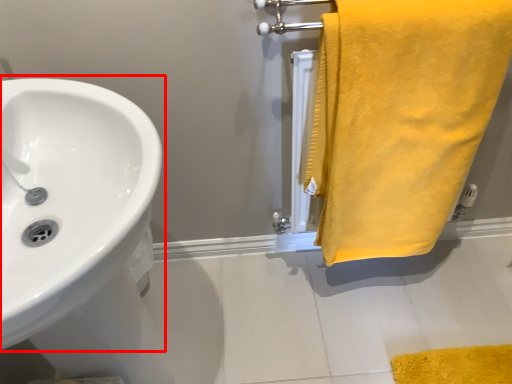
Question: From the image's perspective, what is the correct spatial positioning of sink (annotated by the red box) in reference to towel?

Choices:
 (A) above
 (B) below

Answer: (B)